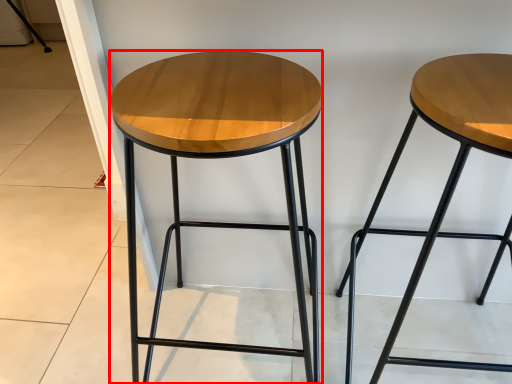
Question: From the image, what is the correct spatial relationship of stool (annotated by the red box) in relation to stool?

Choices:
 (A) left
 (B) right

Answer: (A)